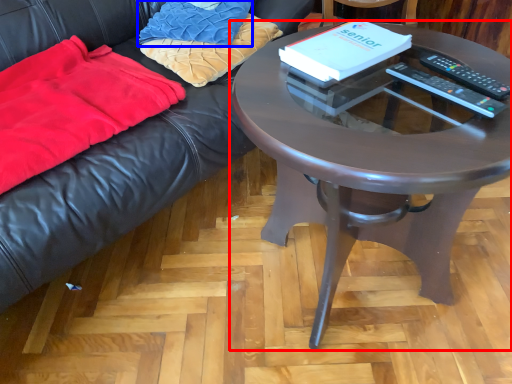
Question: Among these objects, which one is farthest to the camera, coffee table (highlighted by a red box) or pillow (highlighted by a blue box)?

Choices:
 (A) coffee table
 (B) pillow

Answer: (B)